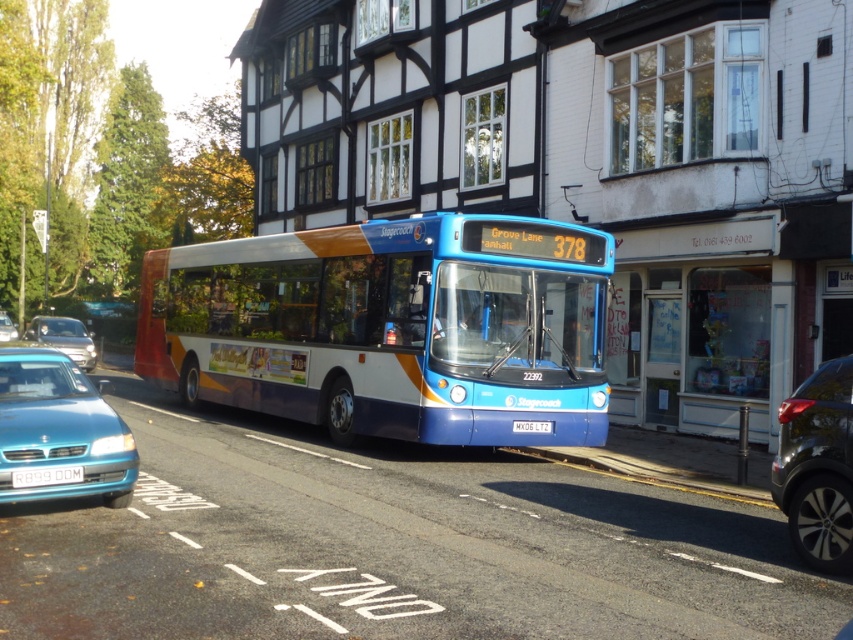
Question: Which point is closer to the camera?

Choices:
 (A) (525, 429)
 (B) (62, 476)

Answer: (B)

Question: Which object is farther from the camera taking this photo?

Choices:
 (A) blue metallic bus at center
 (B) teal glossy car at lower left
 (C) shiny black car at right
 (D) white plastic license plate at lower left

Answer: (B)

Question: Is blue metallic bus at center above teal glossy sedan at lower left?

Choices:
 (A) no
 (B) yes

Answer: (B)

Question: Can you confirm if glass door at center is bigger than white plastic license plate at lower left?

Choices:
 (A) no
 (B) yes

Answer: (B)

Question: Estimate the real-world distances between objects in this image. Which object is closer to the blue metallic bus at center?

Choices:
 (A) glass door at center
 (B) teal glossy sedan at lower left
 (C) shiny black car at right

Answer: (A)

Question: Where is blue metallic bus at center located in relation to white plastic license plate at lower left in the image?

Choices:
 (A) left
 (B) right

Answer: (B)